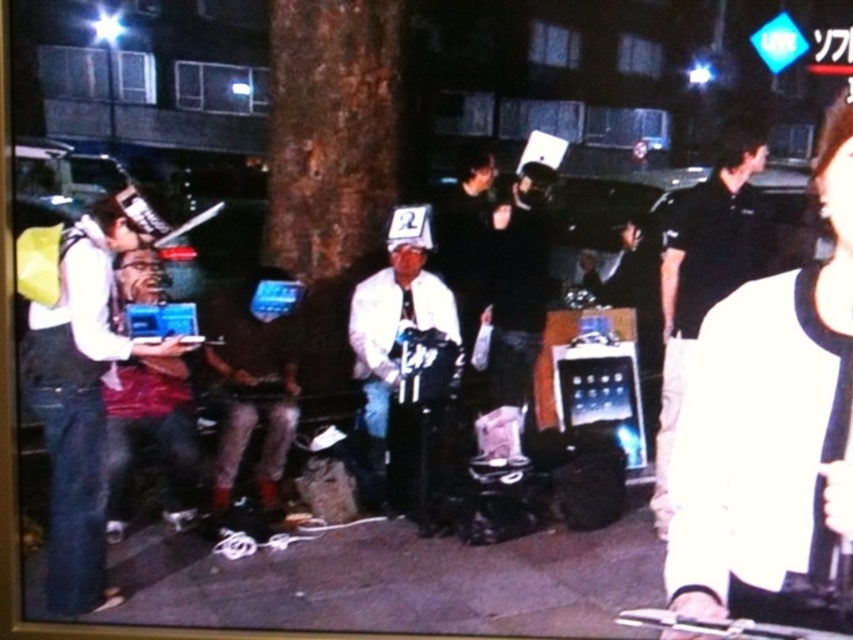
Between black matte shirt at upper right and matte black laptop at left, which one is positioned lower?

matte black laptop at left

Is black matte shirt at upper right shorter than matte black laptop at left?

Yes, black matte shirt at upper right is shorter than matte black laptop at left.

Does point (846, 449) come in front of point (65, 257)?

Yes.

Image resolution: width=853 pixels, height=640 pixels. What are the coordinates of `black matte shirt at upper right` in the screenshot? It's located at (770, 429).

The height and width of the screenshot is (640, 853). What do you see at coordinates (84, 387) in the screenshot? I see `matte black laptop at left` at bounding box center [84, 387].

You are a GUI agent. You are given a task and a screenshot of the screen. Output one action in this format:
    pyautogui.click(x=<x>, y=<y>)
    Task: Click on the matte black laptop at left
    This screenshot has width=853, height=640.
    Given the screenshot: What is the action you would take?
    pyautogui.click(x=84, y=387)

Who is more distant from viewer, [74,376] or [693,276]?

The point [693,276] is behind.

In order to click on matte black laptop at left in this screenshot , I will do `click(84, 387)`.

Between point (218, 499) and point (376, 403), which one is positioned in front?

Point (218, 499) is in front.

Which is more to the left, metallic silver laptop at center or white matte laptop at center?

Positioned to the left is metallic silver laptop at center.

Locate an element on the screen. metallic silver laptop at center is located at coordinates (251, 392).